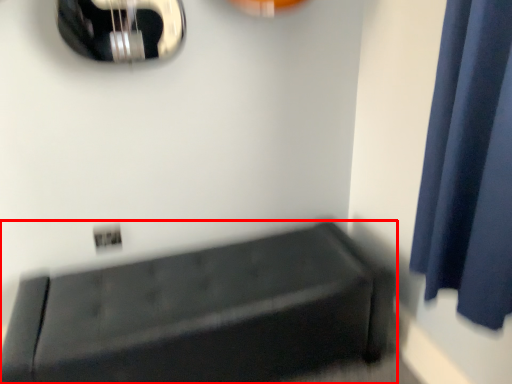
Question: In this image, where is furniture (annotated by the red box) located relative to curtain?

Choices:
 (A) right
 (B) left

Answer: (B)